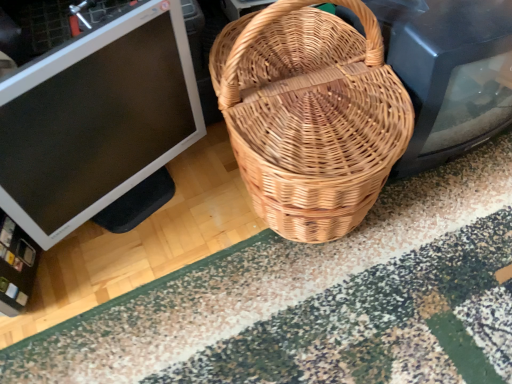
What are the coordinates of `free region under patterned carpet at center (from a real-world perspective)` in the screenshot? It's located at (351, 303).